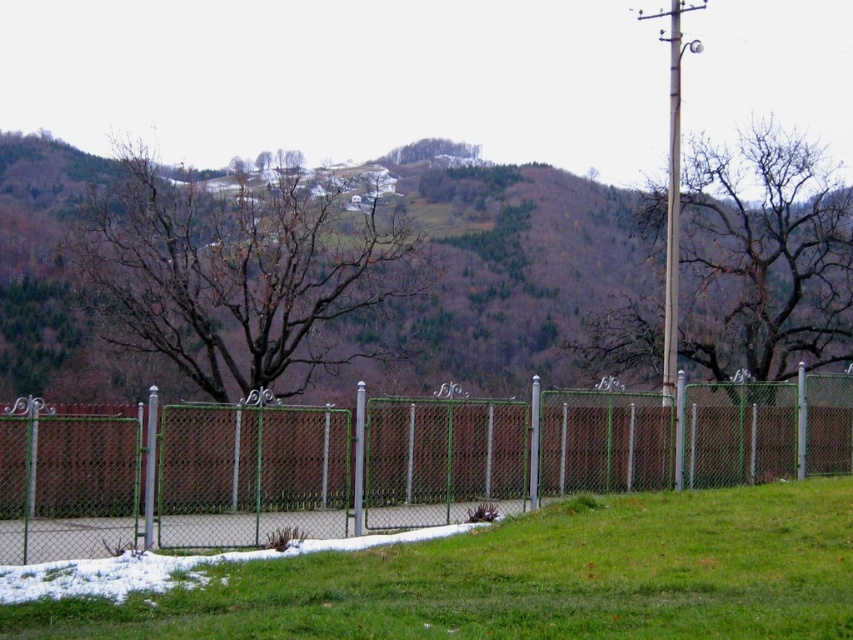
Question: Based on their relative distances, which object is farther from the brown/dry grass at upper center?

Choices:
 (A) green leafy tree at upper center
 (B) green grass at lower center
 (C) bare wood tree at center

Answer: (B)

Question: Considering the relative positions of green grass at lower center and green leafy tree at upper center in the image provided, where is green grass at lower center located with respect to green leafy tree at upper center?

Choices:
 (A) right
 (B) left

Answer: (A)

Question: Which is nearer to the metallic pole at center?

Choices:
 (A) green metallic pole at left
 (B) green chain-link fence at center
 (C) brown leafless tree at center

Answer: (B)

Question: Does green chain-link fence at center lie behind brown/dry grass at upper center?

Choices:
 (A) no
 (B) yes

Answer: (A)

Question: Does brown leafless tree at center have a lesser width compared to metallic pole at center?

Choices:
 (A) yes
 (B) no

Answer: (B)

Question: Which point is closer to the camera?

Choices:
 (A) pyautogui.click(x=155, y=451)
 (B) pyautogui.click(x=743, y=410)
 (C) pyautogui.click(x=403, y=147)

Answer: (A)